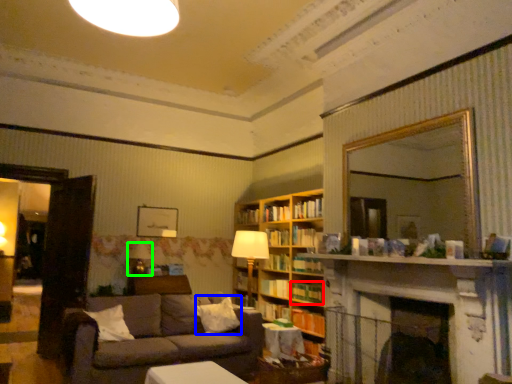
Question: Which object is the closest to the book (highlighted by a red box)? Choose among these: pillow (highlighted by a blue box) or table lamp (highlighted by a green box).

Choices:
 (A) pillow
 (B) table lamp

Answer: (A)